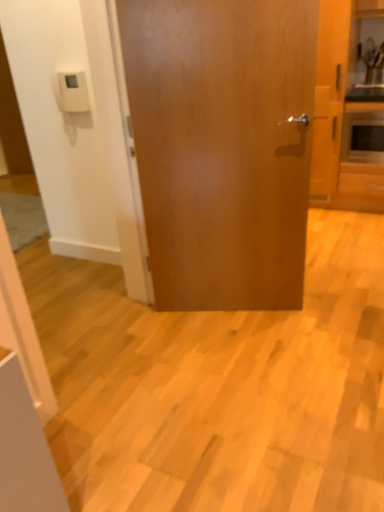
At what (x,y) coordinates should I click in order to perform the action: click on empty space that is to the right of glossy wood door at center. Please return your answer as a coordinate pair (x, y). Looking at the image, I should click on pyautogui.click(x=327, y=309).